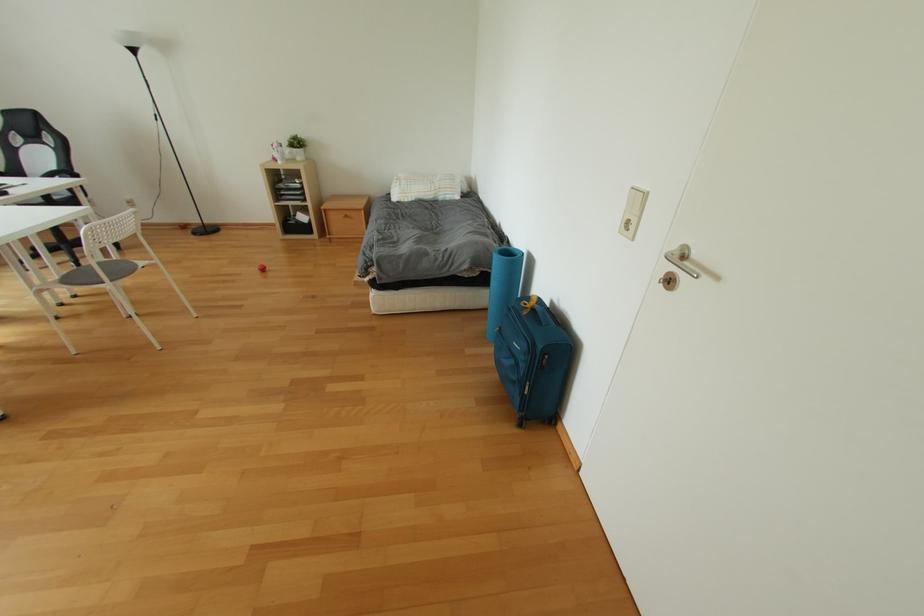
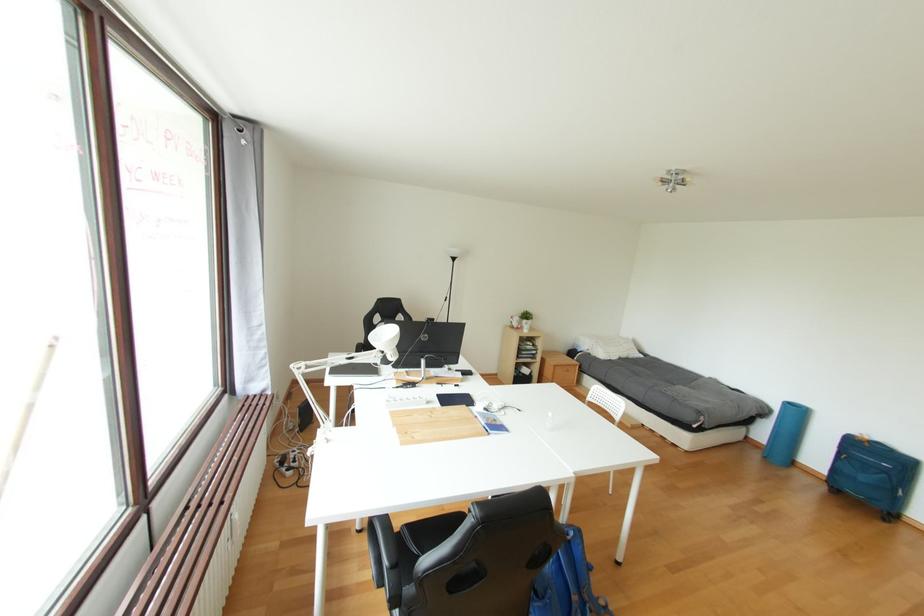
Question: In a continuous first-person perspective shot, in which direction is the camera moving?

Choices:
 (A) Left
 (B) Right
 (C) Forward
 (D) Backward

Answer: (A)